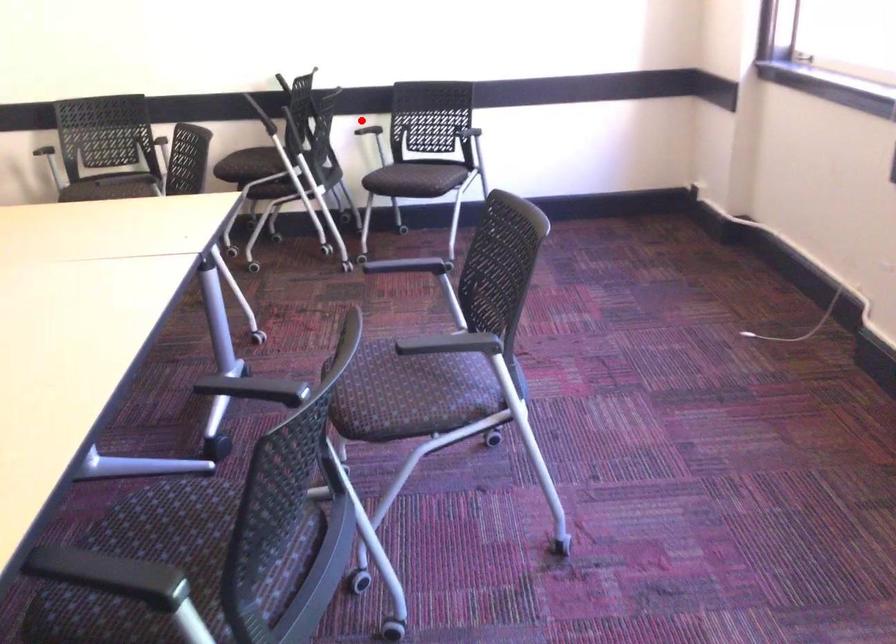
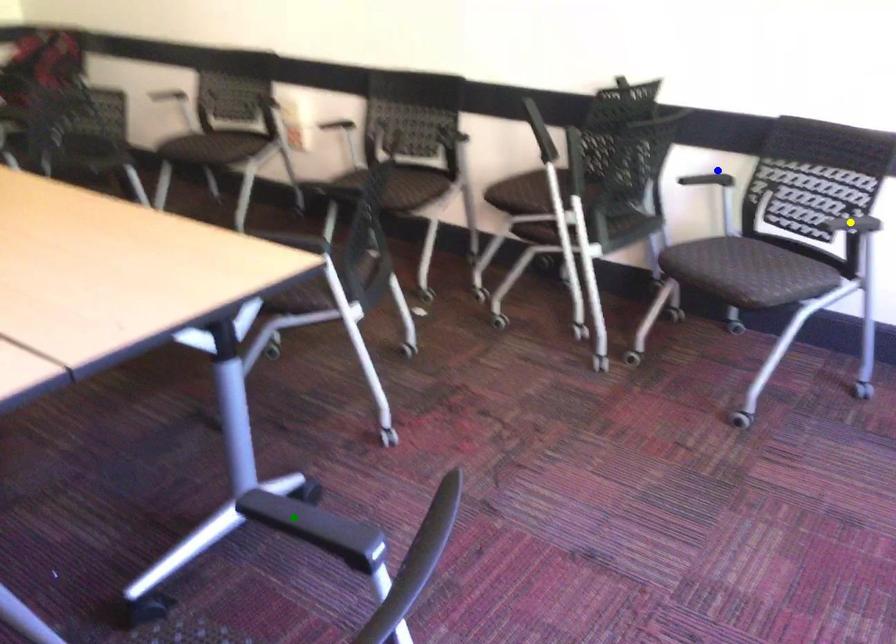
Question: I am providing you with two images of the same scene from different viewpoints. A red point is marked on the first image. You are given multiple points on the second image. Which spot in image 2 lines up with the point in image 1?

Choices:
 (A) yellow point
 (B) green point
 (C) blue point

Answer: (C)